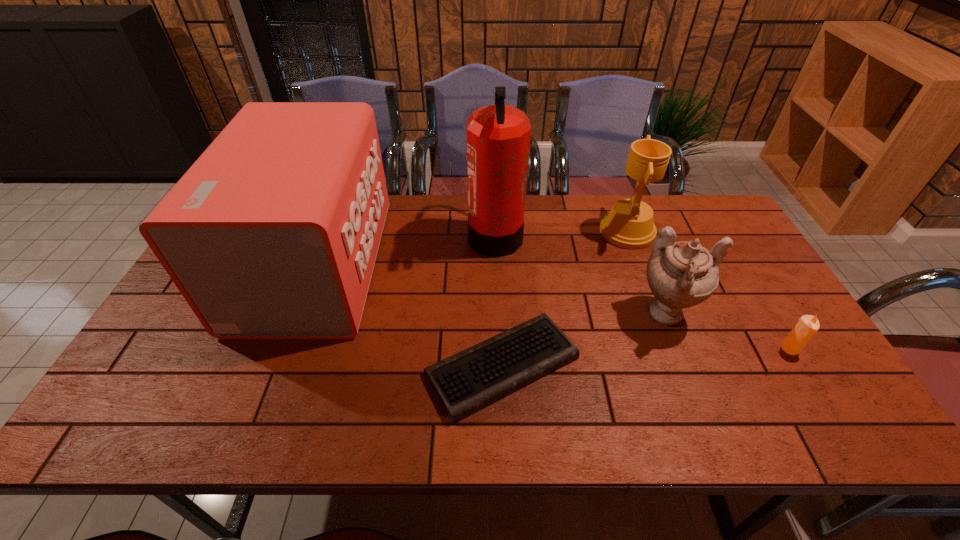
I want to click on vacant position in the image that satisfies the following two spatial constraints: 1. on the front side of the award; 2. on the right side of the urn, so click(659, 316).

The height and width of the screenshot is (540, 960). I want to click on vacant space that satisfies the following two spatial constraints: 1. on the back side of the shortest object; 2. on the surface of the leftmost object where the text is embossed, so click(498, 265).

Locate an element on the screen. The height and width of the screenshot is (540, 960). vacant area in the image that satisfies the following two spatial constraints: 1. on the back side of the shortest object; 2. on the front side of the tallest object is located at coordinates (496, 235).

Image resolution: width=960 pixels, height=540 pixels. Identify the location of vacant space that satisfies the following two spatial constraints: 1. on the surface of the box where the text is embossed; 2. on the left side of the shortest object. (276, 366).

The image size is (960, 540). In order to click on free space that satisfies the following two spatial constraints: 1. on the back side of the urn; 2. on the surface of the box where the text is embossed in this screenshot , I will do `click(648, 265)`.

Image resolution: width=960 pixels, height=540 pixels. I want to click on blank area in the image that satisfies the following two spatial constraints: 1. on the back side of the award; 2. on the right side of the shortest object, so click(x=496, y=232).

I want to click on free space that satisfies the following two spatial constraints: 1. on the back side of the urn; 2. on the surface of the fifth shortest object where the text is embossed, so click(x=648, y=265).

Find the location of a particular element. The height and width of the screenshot is (540, 960). free point that satisfies the following two spatial constraints: 1. on the surface of the computer keyboard where the text is embossed; 2. on the right side of the box is located at coordinates (276, 366).

You are a GUI agent. You are given a task and a screenshot of the screen. Output one action in this format:
    pyautogui.click(x=<x>, y=<y>)
    Task: Click on the blank area in the image that satisfies the following two spatial constraints: 1. on the surface of the leftmost object where the text is embossed; 2. on the back side of the urn
    
    Given the screenshot: What is the action you would take?
    pyautogui.click(x=295, y=316)